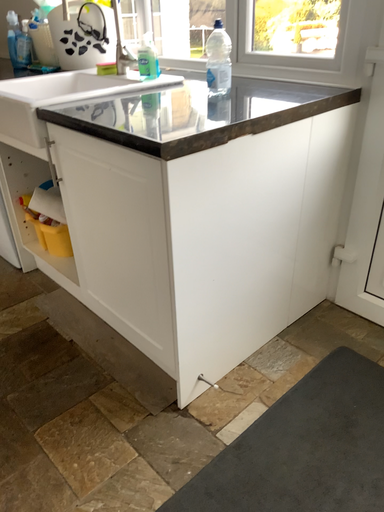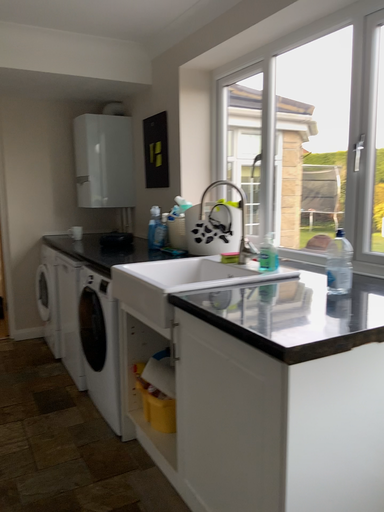
Question: How did the camera likely rotate when shooting the video?

Choices:
 (A) rotated upward
 (B) rotated downward

Answer: (A)